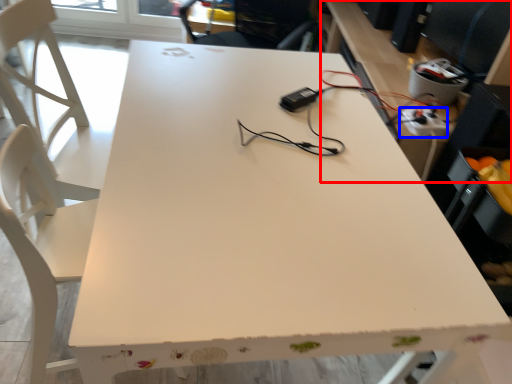
Question: Which object appears closest to the camera in this image, computer desk (highlighted by a red box) or extension cord (highlighted by a blue box)?

Choices:
 (A) computer desk
 (B) extension cord

Answer: (A)